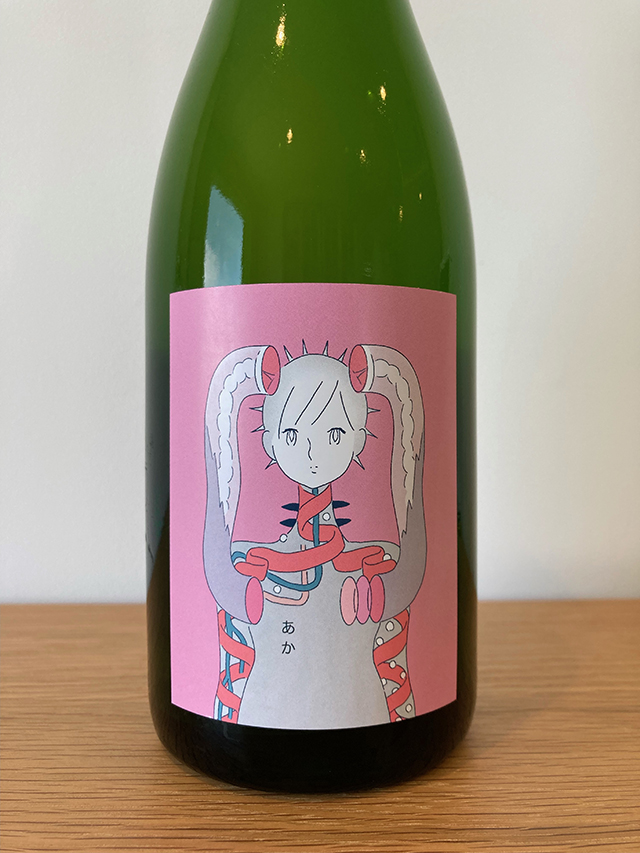
Find the location of a particular element. This screenshot has height=853, width=640. wooden counter top is located at coordinates (511, 692).